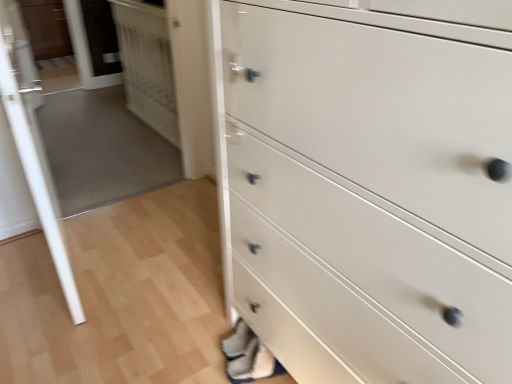
Identify the location of vacant space in front of transparent glass door at left, which appears as the 2th glass door when viewed from the back. (61, 322).